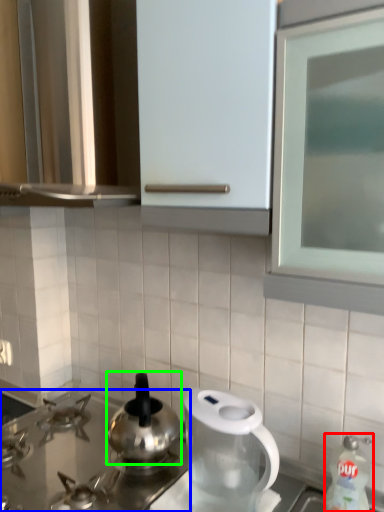
Question: Which object is the closest to the cleaning product (highlighted by a red box)? Choose among these: gas stove (highlighted by a blue box) or kitchen appliance (highlighted by a green box).

Choices:
 (A) gas stove
 (B) kitchen appliance

Answer: (B)